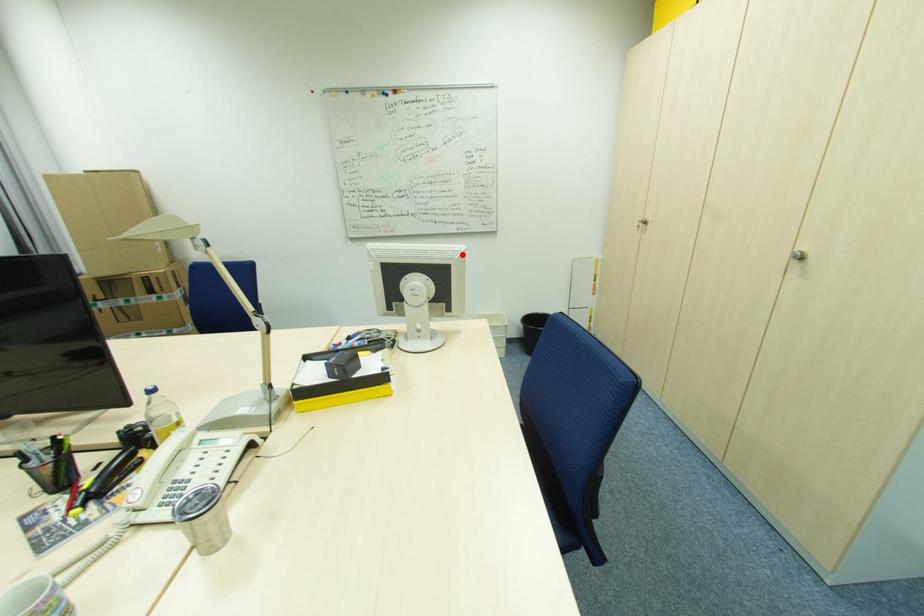
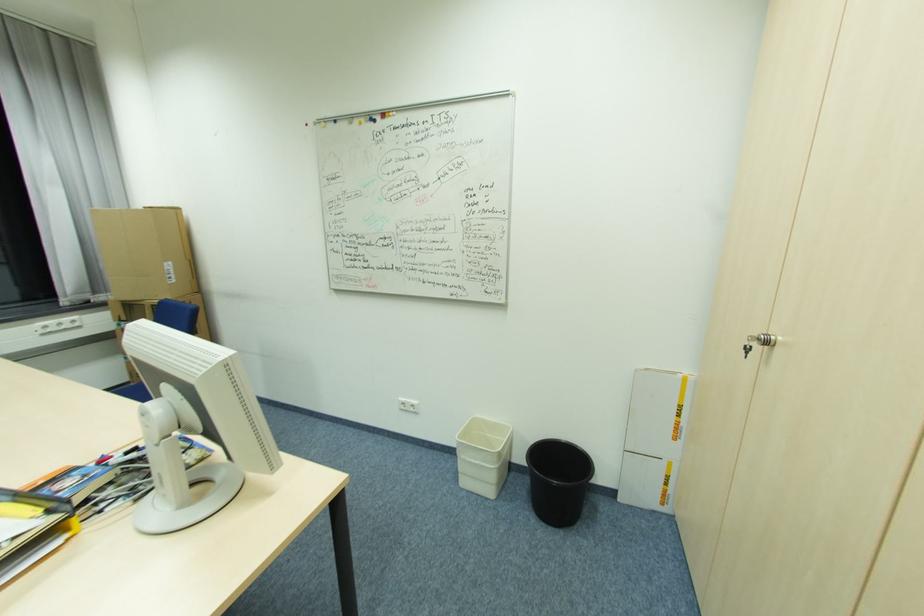
Where in the second image is the point corresponding to the highlighted location from the first image?

(207, 371)